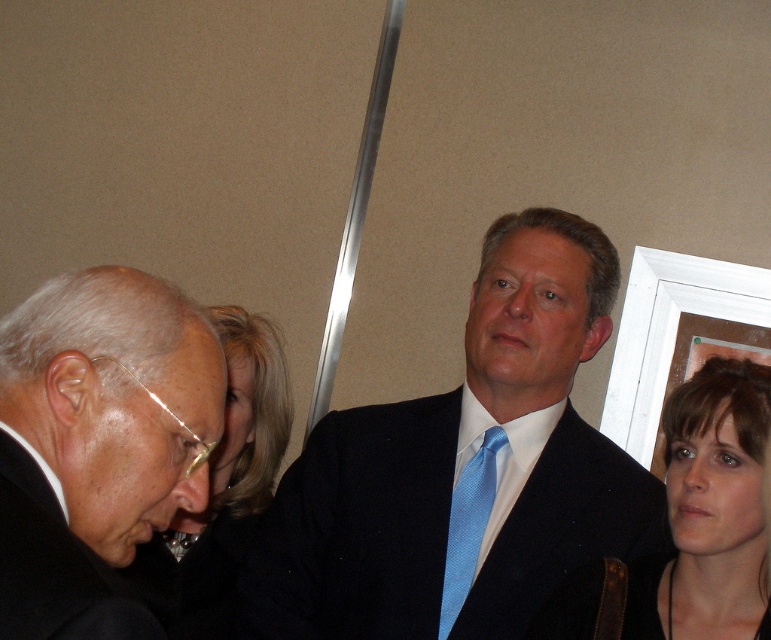
You are a photographer adjusting your camera settings to capture the scene. You notice the brown hair at upper right and the white wooden picture frame at upper right in your viewfinder. Which object should you focus on first if you want to ensure both are in sharp focus, considering their positions?

You should focus on the brown hair at upper right first because it is closer to the camera than the white wooden picture frame at upper right, which is further away. By focusing on the closer object, you can achieve sharpness for both if they are within the depth of field.